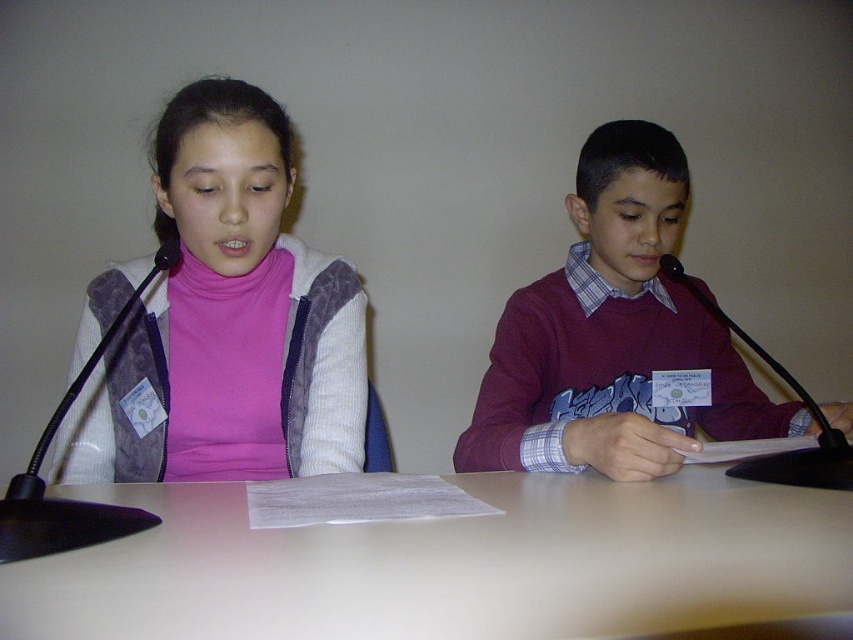
At what (x,y) coordinates should I click in order to perform the action: click on white matte table at center. Please return your answer as a coordinate pair (x, y). Looking at the image, I should click on (451, 564).

Measure the distance between white matte table at center and camera.

A distance of 17.37 inches exists between white matte table at center and camera.

Locate an element on the screen. The height and width of the screenshot is (640, 853). white matte table at center is located at coordinates (451, 564).

Locate an element on the screen. This screenshot has height=640, width=853. white matte table at center is located at coordinates (451, 564).

Which is above, white matte table at center or maroon sweater at center?

maroon sweater at center is higher up.

From the picture: Is white matte table at center above maroon sweater at center?

No.

Who is more distant from viewer, (x=834, y=598) or (x=592, y=186)?

Point (x=592, y=186)

This screenshot has width=853, height=640. I want to click on white matte table at center, so click(x=451, y=564).

Who is higher up, pink fleece sweater at left or maroon sweater at center?

pink fleece sweater at left

Find the location of a particular element. pink fleece sweater at left is located at coordinates (229, 317).

In the scene shown: Who is more distant from viewer, [86,298] or [724,403]?

Positioned behind is point [724,403].

Where is `pink fleece sweater at left`? pink fleece sweater at left is located at coordinates (229, 317).